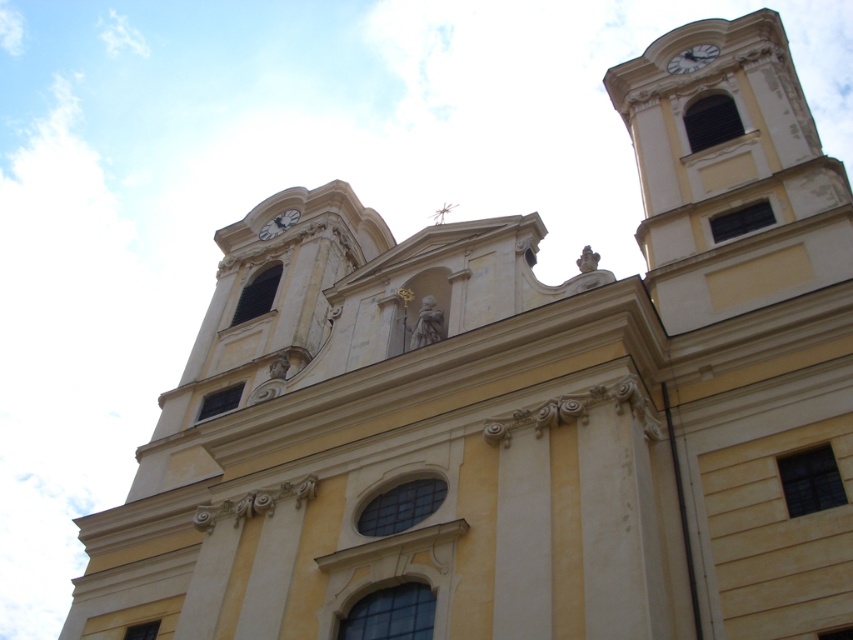
Question: Is white glossy clock at upper right positioned behind white glossy clock at upper center?

Choices:
 (A) no
 (B) yes

Answer: (A)

Question: Which object is farther from the camera taking this photo?

Choices:
 (A) white glossy clock at upper center
 (B) white glossy clock at upper right

Answer: (A)

Question: Is white glossy clock at upper right bigger than white glossy clock at upper center?

Choices:
 (A) no
 (B) yes

Answer: (A)

Question: Which of the following is the closest to the observer?

Choices:
 (A) white glossy clock at upper right
 (B) white glossy clock at upper center

Answer: (A)

Question: Does white glossy clock at upper right come in front of white glossy clock at upper center?

Choices:
 (A) yes
 (B) no

Answer: (A)